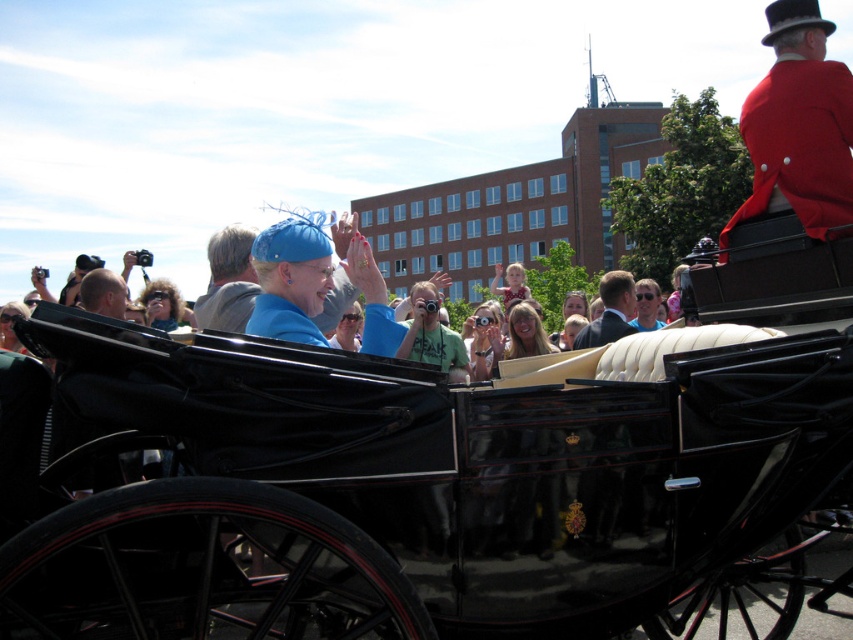
Question: Where is black polished wood horse cart at center located in relation to smooth bald head at center in the image?

Choices:
 (A) right
 (B) left

Answer: (A)

Question: Which object is positioned farthest from the matte blue hat at center?

Choices:
 (A) red wool coat at upper right
 (B) smooth bald head at center

Answer: (A)

Question: Estimate the real-world distances between objects in this image. Which object is closer to the black polished wood horse cart at center?

Choices:
 (A) smooth bald head at center
 (B) red wool coat at upper right

Answer: (B)

Question: Which of the following is the closest to the observer?

Choices:
 (A) matte blue hat at center
 (B) suit at center
 (C) smooth bald head at center

Answer: (A)

Question: Is matte blue hat at center to the left of smooth bald head at center from the viewer's perspective?

Choices:
 (A) yes
 (B) no

Answer: (B)

Question: Does red wool coat at upper right have a smaller size compared to smooth bald head at center?

Choices:
 (A) no
 (B) yes

Answer: (A)